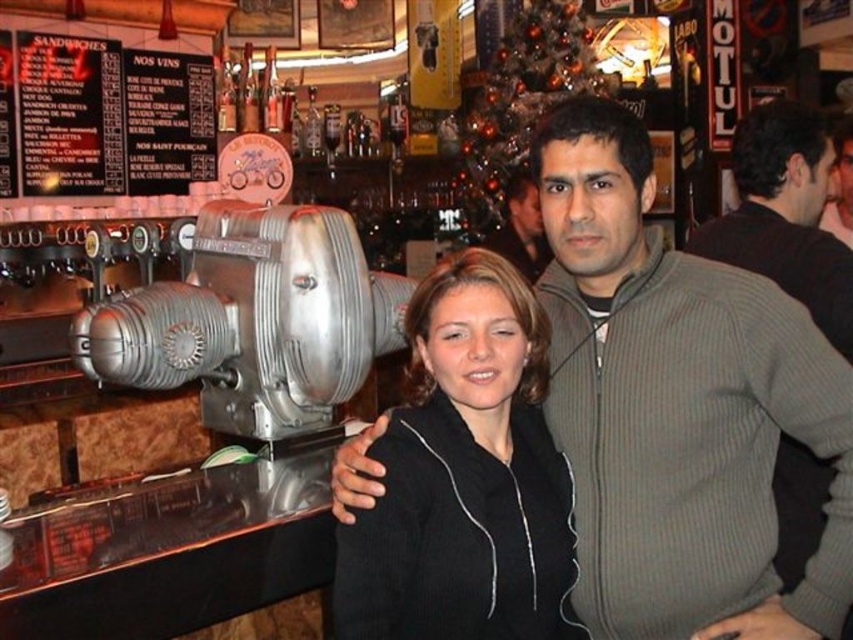
Question: Among these objects, which one is nearest to the camera?

Choices:
 (A) black matte jacket at center
 (B) black zip-up jacket at center
 (C) dark gray sweater at right
 (D) gray zip-up sweater at center

Answer: (A)

Question: Is black matte jacket at center to the left of gray zip-up sweater at center from the viewer's perspective?

Choices:
 (A) no
 (B) yes

Answer: (B)

Question: Which of the following is the farthest from the observer?

Choices:
 (A) dark gray sweater at right
 (B) gray zip-up sweater at center
 (C) black zip-up jacket at center
 (D) black matte jacket at center

Answer: (B)

Question: Which point is closer to the camera?

Choices:
 (A) (706, 576)
 (B) (474, 376)

Answer: (B)

Question: Where is black matte jacket at center located in relation to dark gray sweater at right in the image?

Choices:
 (A) above
 (B) below

Answer: (B)

Question: Is black zip-up jacket at center to the right of dark gray sweater at right from the viewer's perspective?

Choices:
 (A) no
 (B) yes

Answer: (A)